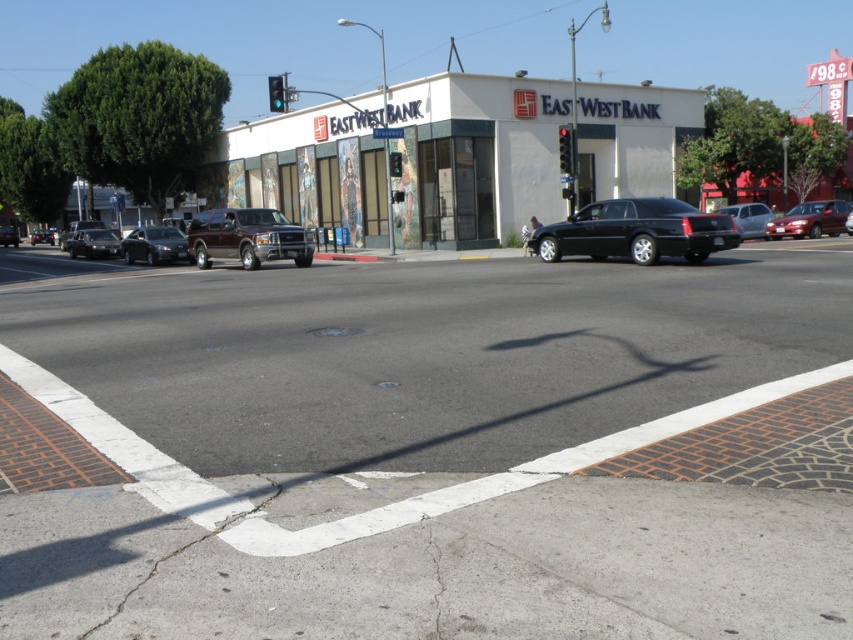
Is point (798, 211) less distant than point (397, 150)?

Yes, point (798, 211) is in front of point (397, 150).

Is shiny red sedan at center to the left of green glass traffic light at center from the viewer's perspective?

Incorrect, shiny red sedan at center is not on the left side of green glass traffic light at center.

Is point (833, 209) more distant than point (392, 173)?

Yes, point (833, 209) is behind point (392, 173).

Find the location of `shiny red sedan at center`. shiny red sedan at center is located at coordinates (809, 220).

Who is higher up, shiny silver sedan at left or matte black suv at center?

matte black suv at center is above.

Does shiny silver sedan at left appear under matte black suv at center?

Indeed, shiny silver sedan at left is positioned under matte black suv at center.

Find the location of a particular element. shiny silver sedan at left is located at coordinates (93, 243).

The width and height of the screenshot is (853, 640). What are the coordinates of `shiny silver sedan at left` in the screenshot? It's located at (93, 243).

Between satin silver sedan at lower left and green glass traffic light at center, which one is positioned lower?

Positioned lower is satin silver sedan at lower left.

In the scene shown: Between satin silver sedan at lower left and green glass traffic light at center, which one is positioned higher?

green glass traffic light at center is higher up.

Is point (155, 262) closer to viewer compared to point (396, 168)?

That is True.

Locate an element on the screen. satin silver sedan at lower left is located at coordinates (154, 244).